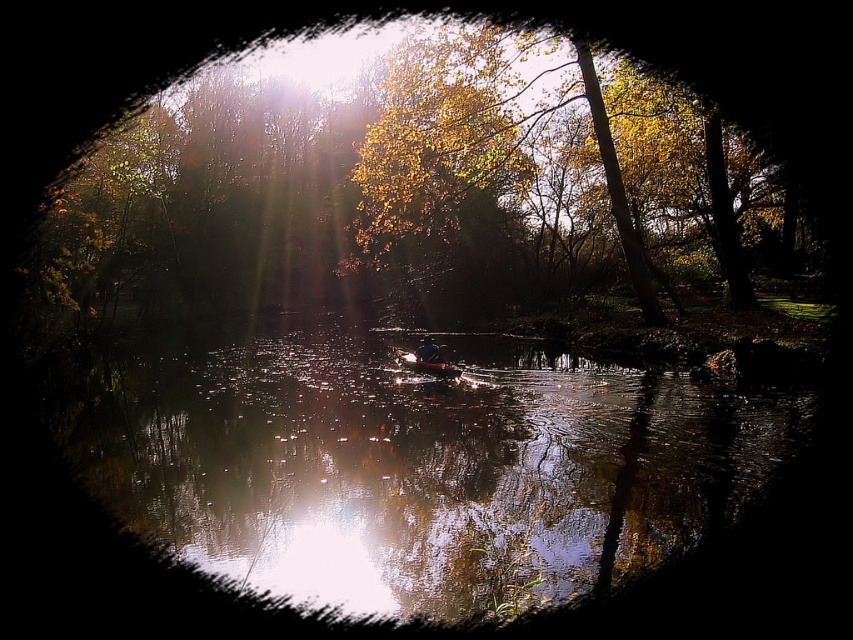
Can you confirm if glossy reflective water at center is positioned to the right of yellow leafy tree at center?

Yes, glossy reflective water at center is to the right of yellow leafy tree at center.

Between glossy reflective water at center and yellow leafy tree at center, which one has less height?

With less height is glossy reflective water at center.

The width and height of the screenshot is (853, 640). I want to click on glossy reflective water at center, so click(x=410, y=461).